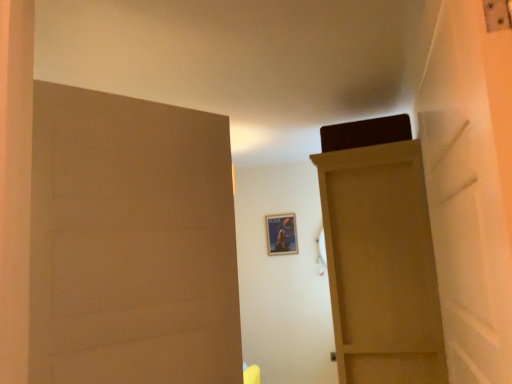
You are a GUI agent. You are given a task and a screenshot of the screen. Output one action in this format:
    pyautogui.click(x=<x>, y=<y>)
    Task: Click on the matte wood door at upper right, placed as the 1th door when sorted from right to left
    
    Given the screenshot: What is the action you would take?
    pyautogui.click(x=381, y=265)

Measure the distance between metallic poster at center and camera.

metallic poster at center and camera are 14.40 feet apart from each other.

The height and width of the screenshot is (384, 512). In order to click on matte wood door at upper right, placed as the 1th door when sorted from right to left in this screenshot , I will do `click(381, 265)`.

Can you tell me how much matte wood door at left, which appears as the 1th door when viewed from the left, and matte wood door at upper right, placed as the 1th door when sorted from right to left, differ in facing direction?

There is a 29.8-degree angle between the facing directions of matte wood door at left, which appears as the 1th door when viewed from the left, and matte wood door at upper right, placed as the 1th door when sorted from right to left.

From the image's perspective, is matte wood door at left, which appears as the 1th door when viewed from the left, on top of matte wood door at upper right, arranged as the 2th door when viewed from the left?

Yes, from the image's perspective, matte wood door at left, which appears as the 1th door when viewed from the left, is over matte wood door at upper right, arranged as the 2th door when viewed from the left.

Locate an element on the screen. This screenshot has width=512, height=384. door located above the matte wood door at upper right, arranged as the 2th door when viewed from the front (from a real-world perspective) is located at coordinates (131, 242).

Do you think matte wood door at left, which appears as the 1th door when viewed from the left, is within matte wood door at upper right, arranged as the 2th door when viewed from the left, or outside of it?

matte wood door at left, which appears as the 1th door when viewed from the left, exists outside the volume of matte wood door at upper right, arranged as the 2th door when viewed from the left.

From a real-world perspective, is matte wood door at upper right, arranged as the 2th door when viewed from the front, on metallic poster at center?

No, from a real-world perspective, matte wood door at upper right, arranged as the 2th door when viewed from the front, is not on top of metallic poster at center.

From the image's perspective, between matte wood door at upper right, arranged as the 2th door when viewed from the left, and metallic poster at center, which one is located above?

From the image's view, metallic poster at center is above.

Between matte wood door at upper right, placed as the 1th door when sorted from right to left, and metallic poster at center, which one has smaller width?

With smaller width is metallic poster at center.

Is matte wood door at upper right, placed as the 1th door when sorted from right to left, further to camera compared to matte wood door at left, which appears as the 1th door when viewed from the left?

Yes, matte wood door at upper right, placed as the 1th door when sorted from right to left, is further from the viewer.

Is matte wood door at upper right, acting as the first door starting from the back, with matte wood door at left, the first door positioned from the front?

No, matte wood door at upper right, acting as the first door starting from the back, is not with matte wood door at left, the first door positioned from the front.

Measure the distance from matte wood door at upper right, arranged as the 2th door when viewed from the front, to matte wood door at left, which appears as the 1th door when viewed from the left.

matte wood door at upper right, arranged as the 2th door when viewed from the front, is 36.60 inches from matte wood door at left, which appears as the 1th door when viewed from the left.

From the image's perspective, between matte wood door at upper right, arranged as the 2th door when viewed from the front, and matte wood door at left, which appears as the 1th door when viewed from the left, which one is located above?

matte wood door at left, which appears as the 1th door when viewed from the left, from the image's perspective.

Is metallic poster at center oriented away from matte wood door at left, which appears as the 1th door when viewed from the left?

No.

Is the depth of metallic poster at center greater than that of matte wood door at left, arranged as the 2th door when viewed from the back?

Yes, the depth of metallic poster at center is greater than that of matte wood door at left, arranged as the 2th door when viewed from the back.

Can you tell me how much metallic poster at center and matte wood door at left, the first door positioned from the front, differ in facing direction?

The angular difference between metallic poster at center and matte wood door at left, the first door positioned from the front, is 120 degrees.

Between point (278, 232) and point (170, 146), which one is positioned behind?

Positioned behind is point (278, 232).

Locate an element on the screen. The height and width of the screenshot is (384, 512). picture frame on the right side of matte wood door at left, arranged as the 2th door when viewed from the back is located at coordinates (281, 234).

Is matte wood door at left, the second door when ordered from right to left, spatially inside metallic poster at center, or outside of it?

The correct answer is: outside.

From the image's perspective, is matte wood door at left, the first door positioned from the front, above or below metallic poster at center?

Clearly, from the image's perspective, matte wood door at left, the first door positioned from the front, is above metallic poster at center.

Considering the sizes of objects metallic poster at center and matte wood door at upper right, arranged as the 2th door when viewed from the front, in the image provided, who is shorter, metallic poster at center or matte wood door at upper right, arranged as the 2th door when viewed from the front,?

Standing shorter between the two is metallic poster at center.

Is point (269, 229) behind point (370, 146)?

Yes, point (269, 229) is farther from viewer.

The image size is (512, 384). In the image, there is a matte wood door at upper right, arranged as the 2th door when viewed from the front. Find the location of `picture frame above it (from the image's perspective)`. picture frame above it (from the image's perspective) is located at coordinates (281, 234).

Is metallic poster at center not within matte wood door at upper right, acting as the first door starting from the back?

Yes, metallic poster at center is located beyond the bounds of matte wood door at upper right, acting as the first door starting from the back.

Find the location of a particular element. This screenshot has height=384, width=512. door that is behind the matte wood door at left, the first door positioned from the front is located at coordinates (381, 265).

From the metallic poster at center, count 1st doors forward and point to it. Please provide its 2D coordinates.

[(381, 265)]

Which object lies nearer to the anchor point metallic poster at center, matte wood door at upper right, arranged as the 2th door when viewed from the front, or matte wood door at left, the second door when ordered from right to left?

matte wood door at upper right, arranged as the 2th door when viewed from the front, is closer to metallic poster at center.

Estimate the real-world distances between objects in this image. Which object is closer to matte wood door at left, the second door when ordered from right to left, metallic poster at center or matte wood door at upper right, arranged as the 2th door when viewed from the left?

matte wood door at upper right, arranged as the 2th door when viewed from the left.

Based on their spatial positions, is matte wood door at upper right, acting as the first door starting from the back, or metallic poster at center further from matte wood door at left, arranged as the 2th door when viewed from the back?

The object further to matte wood door at left, arranged as the 2th door when viewed from the back, is metallic poster at center.

Which object lies further to the anchor point matte wood door at upper right, placed as the 1th door when sorted from right to left, metallic poster at center or matte wood door at left, the second door when ordered from right to left?

metallic poster at center lies further to matte wood door at upper right, placed as the 1th door when sorted from right to left, than the other object.

From the image, which object appears to be farther from metallic poster at center, matte wood door at left, the second door when ordered from right to left, or matte wood door at upper right, arranged as the 2th door when viewed from the left?

matte wood door at left, the second door when ordered from right to left, lies further to metallic poster at center than the other object.

Considering their positions, is matte wood door at left, the second door when ordered from right to left, positioned further to matte wood door at upper right, arranged as the 2th door when viewed from the front, than metallic poster at center?

metallic poster at center is further to matte wood door at upper right, arranged as the 2th door when viewed from the front.

I want to click on door located between matte wood door at left, arranged as the 2th door when viewed from the back, and metallic poster at center in the depth direction, so click(x=381, y=265).